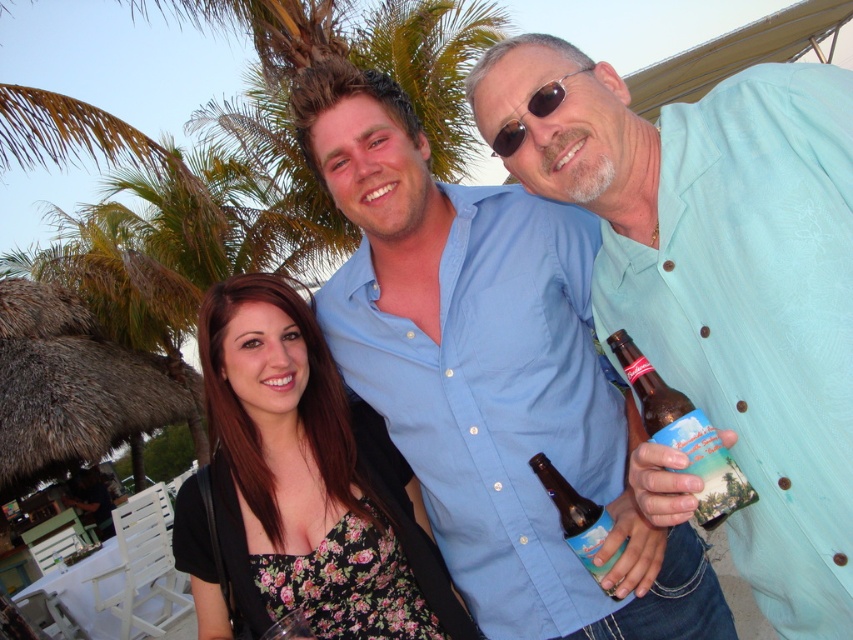
Can you confirm if light blue shirt at center is positioned below brown glass bottle at center?

No, light blue shirt at center is not below brown glass bottle at center.

Is point (834, 595) behind point (569, 484)?

No, (834, 595) is in front of (569, 484).

The height and width of the screenshot is (640, 853). Describe the element at coordinates (734, 292) in the screenshot. I see `light blue shirt at center` at that location.

At what (x,y) coordinates should I click in order to perform the action: click on light blue shirt at center. Please return your answer as a coordinate pair (x, y). Looking at the image, I should click on (734, 292).

Is light blue shirt at center shorter than brown glass bottle at center-right?

In fact, light blue shirt at center may be taller than brown glass bottle at center-right.

Between light blue shirt at center and brown glass bottle at center-right, which one has less height?

brown glass bottle at center-right

Which is behind, point (780, 579) or point (641, 388)?

Point (780, 579)

What are the coordinates of `light blue shirt at center` in the screenshot? It's located at (734, 292).

Consider the image. Does brown glass bottle at center have a smaller size compared to sunglasses at center?

Incorrect, brown glass bottle at center is not smaller in size than sunglasses at center.

Does point (616, 550) come closer to viewer compared to point (538, 96)?

No, (616, 550) is further to viewer.

Measure the distance between brown glass bottle at center and camera.

1.51 meters

Where is `brown glass bottle at center`? This screenshot has height=640, width=853. brown glass bottle at center is located at coordinates (577, 516).